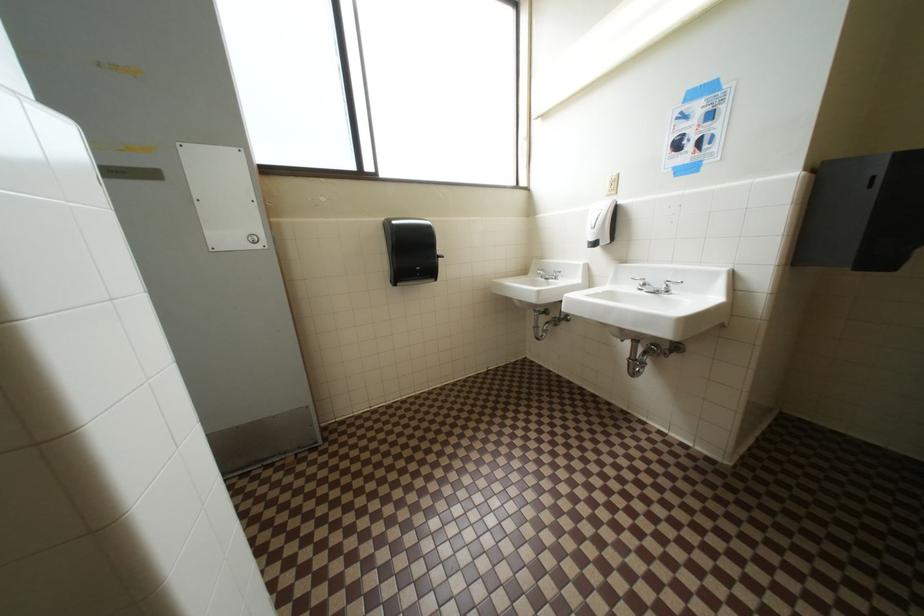
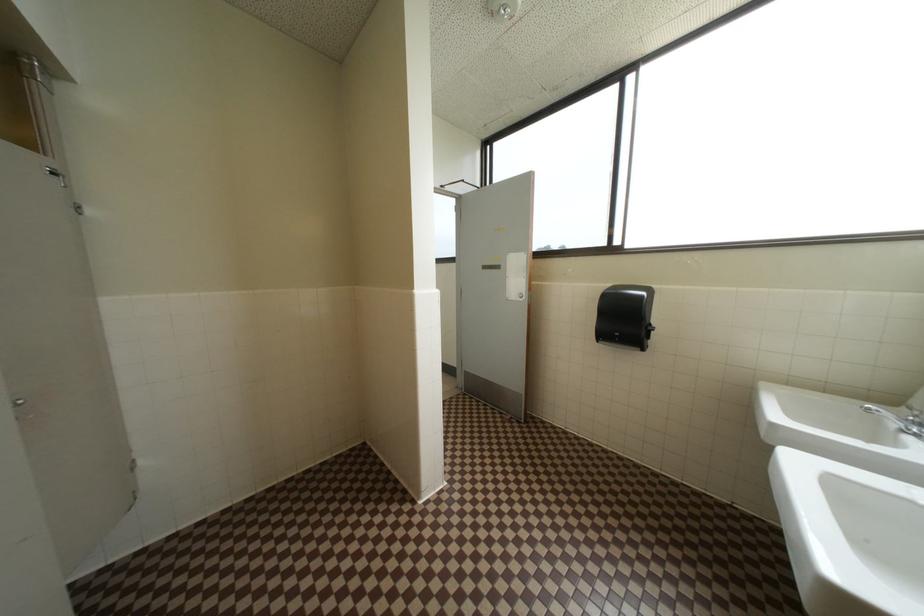
Question: The camera is either moving clockwise (left) or counter-clockwise (right) around the object. The first image is from the beginning of the video and the second image is from the end. Is the camera moving left or right when shooting the video?

Choices:
 (A) Left
 (B) Right

Answer: (B)